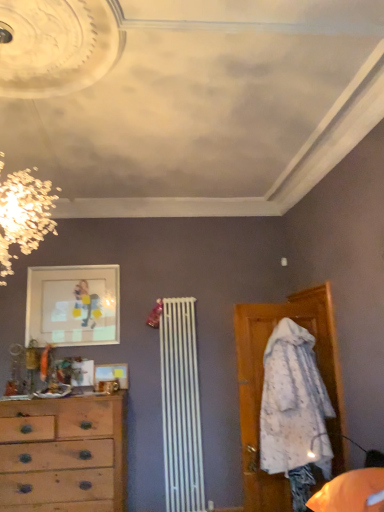
Question: In which direction should I rotate to look at wooden picture frame at center, the 1th picture frame from the bottom?

Choices:
 (A) right
 (B) left

Answer: (B)

Question: Is matte glass picture frame at upper left, positioned as the 1th picture frame in top-to-bottom order, located outside wooden picture frame at center, the 1th picture frame from the bottom?

Choices:
 (A) yes
 (B) no

Answer: (A)

Question: Is matte glass picture frame at upper left, the 2th picture frame in the bottom-to-top sequence, aimed at wooden picture frame at center, the 1th picture frame from the bottom?

Choices:
 (A) no
 (B) yes

Answer: (A)

Question: Does matte glass picture frame at upper left, the 2th picture frame in the bottom-to-top sequence, have a larger size compared to wooden picture frame at center, the 1th picture frame from the bottom?

Choices:
 (A) yes
 (B) no

Answer: (A)

Question: Is wooden picture frame at center, which is the 2th picture frame from top to bottom, at the back of matte glass picture frame at upper left, the 2th picture frame in the bottom-to-top sequence?

Choices:
 (A) yes
 (B) no

Answer: (B)

Question: Does matte glass picture frame at upper left, positioned as the 1th picture frame in top-to-bottom order, lie in front of wooden picture frame at center, the 1th picture frame from the bottom?

Choices:
 (A) yes
 (B) no

Answer: (B)

Question: Considering the relative sizes of matte glass picture frame at upper left, the 2th picture frame in the bottom-to-top sequence, and wooden picture frame at center, the 1th picture frame from the bottom, in the image provided, is matte glass picture frame at upper left, the 2th picture frame in the bottom-to-top sequence, shorter than wooden picture frame at center, the 1th picture frame from the bottom,?

Choices:
 (A) no
 (B) yes

Answer: (A)

Question: Is wooden chest of drawers at left surrounded by matte glass picture frame at upper left, the 2th picture frame in the bottom-to-top sequence?

Choices:
 (A) yes
 (B) no

Answer: (B)

Question: From the image's perspective, is matte glass picture frame at upper left, positioned as the 1th picture frame in top-to-bottom order, above wooden chest of drawers at left?

Choices:
 (A) no
 (B) yes

Answer: (B)

Question: From a real-world perspective, is matte glass picture frame at upper left, the 2th picture frame in the bottom-to-top sequence, under wooden chest of drawers at left?

Choices:
 (A) yes
 (B) no

Answer: (B)

Question: Does matte glass picture frame at upper left, positioned as the 1th picture frame in top-to-bottom order, appear on the left side of wooden chest of drawers at left?

Choices:
 (A) no
 (B) yes

Answer: (B)

Question: Does matte glass picture frame at upper left, the 2th picture frame in the bottom-to-top sequence, have a lesser width compared to wooden chest of drawers at left?

Choices:
 (A) yes
 (B) no

Answer: (A)

Question: Considering the relative sizes of matte glass picture frame at upper left, positioned as the 1th picture frame in top-to-bottom order, and wooden chest of drawers at left in the image provided, is matte glass picture frame at upper left, positioned as the 1th picture frame in top-to-bottom order, taller than wooden chest of drawers at left?

Choices:
 (A) no
 (B) yes

Answer: (A)

Question: Does wooden picture frame at center, the 1th picture frame from the bottom, appear on the right side of wooden chest of drawers at left?

Choices:
 (A) no
 (B) yes

Answer: (B)